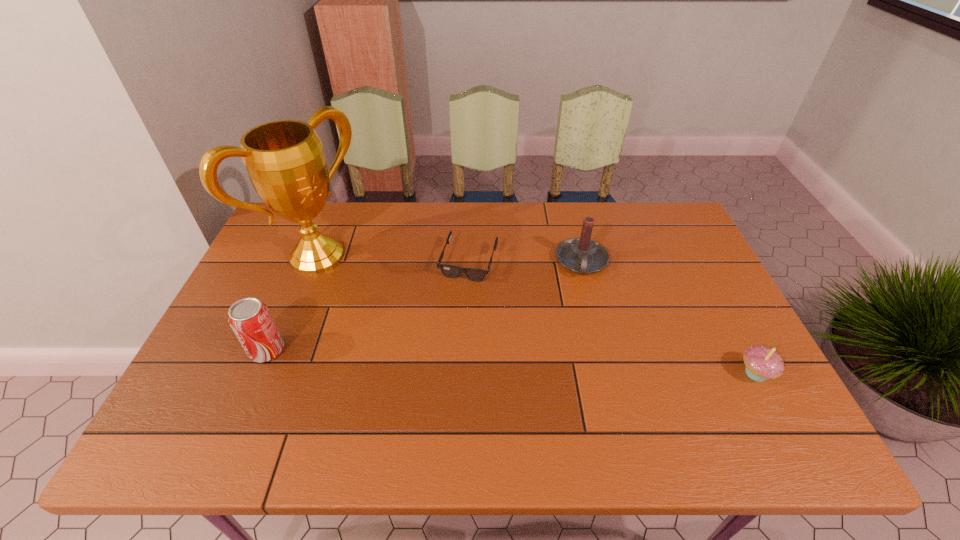
Image resolution: width=960 pixels, height=540 pixels. In order to click on soda can in this screenshot , I will do `click(250, 319)`.

Find the location of `the second shortest object`. the second shortest object is located at coordinates (762, 363).

You are a GUI agent. You are given a task and a screenshot of the screen. Output one action in this format:
    pyautogui.click(x=<x>, y=<y>)
    Task: Click on the cupcake
    
    Given the screenshot: What is the action you would take?
    (762, 363)

In order to click on the tallest object in this screenshot , I will do `click(284, 159)`.

You are a GUI agent. You are given a task and a screenshot of the screen. Output one action in this format:
    pyautogui.click(x=<x>, y=<y>)
    Task: Click on the candle
    
    Given the screenshot: What is the action you would take?
    [x=582, y=255]

The image size is (960, 540). I want to click on the shortest object, so click(450, 271).

The image size is (960, 540). In order to click on sunglasses in this screenshot , I will do (x=450, y=271).

Locate an element on the screen. Image resolution: width=960 pixels, height=540 pixels. free space located 0.080m on the left of the soda can is located at coordinates (218, 350).

The image size is (960, 540). Find the location of `vacant space located 0.220m on the back of the fourth tallest object`. vacant space located 0.220m on the back of the fourth tallest object is located at coordinates (713, 294).

Identify the location of vacant space located on the front-facing side of the award. (424, 339).